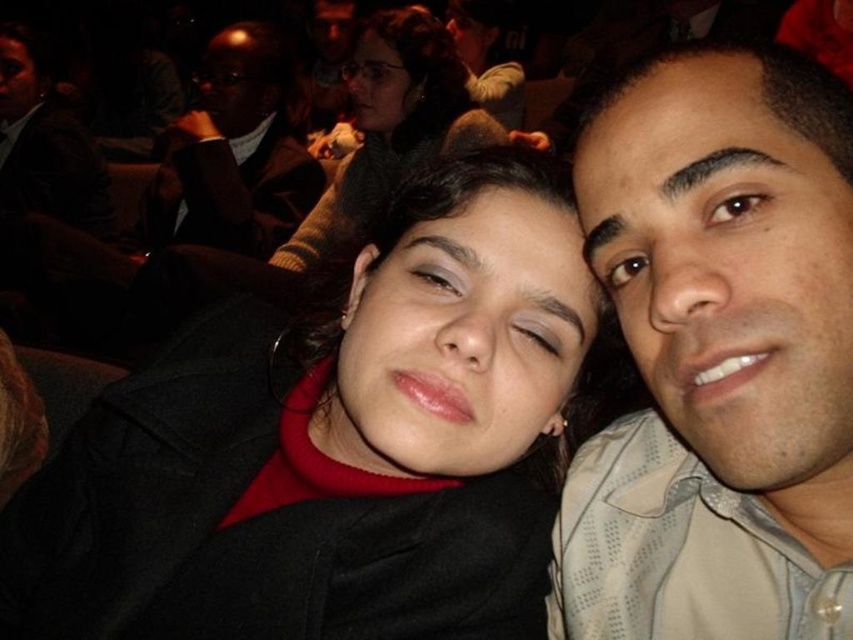
Does matte beige shirt at right have a lesser width compared to matte black hair at upper center?

Yes.

Which is below, matte beige shirt at right or matte black hair at upper center?

matte beige shirt at right

Is point (822, 77) closer to viewer compared to point (317, 225)?

Yes, point (822, 77) is in front of point (317, 225).

Where is `matte beige shirt at right`? matte beige shirt at right is located at coordinates (718, 355).

Does black matte jacket at center have a greater width compared to matte beige shirt at right?

Correct, the width of black matte jacket at center exceeds that of matte beige shirt at right.

Which is behind, point (561, 291) or point (769, 224)?

The point (561, 291) is behind.

Find the location of a particular element. This screenshot has height=640, width=853. black matte jacket at center is located at coordinates (335, 445).

Between matte beige shirt at right and matte black suit at upper left, which one has less height?

matte beige shirt at right is shorter.

At what (x,y) coordinates should I click in order to perform the action: click on matte beige shirt at right. Please return your answer as a coordinate pair (x, y). Looking at the image, I should click on (718, 355).

Identify the location of matte beige shirt at right. Image resolution: width=853 pixels, height=640 pixels. (718, 355).